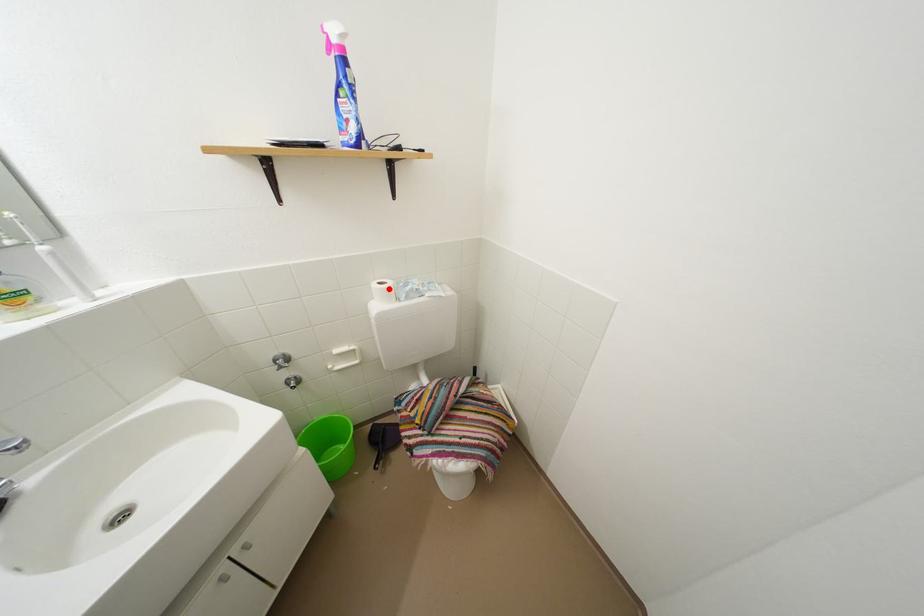
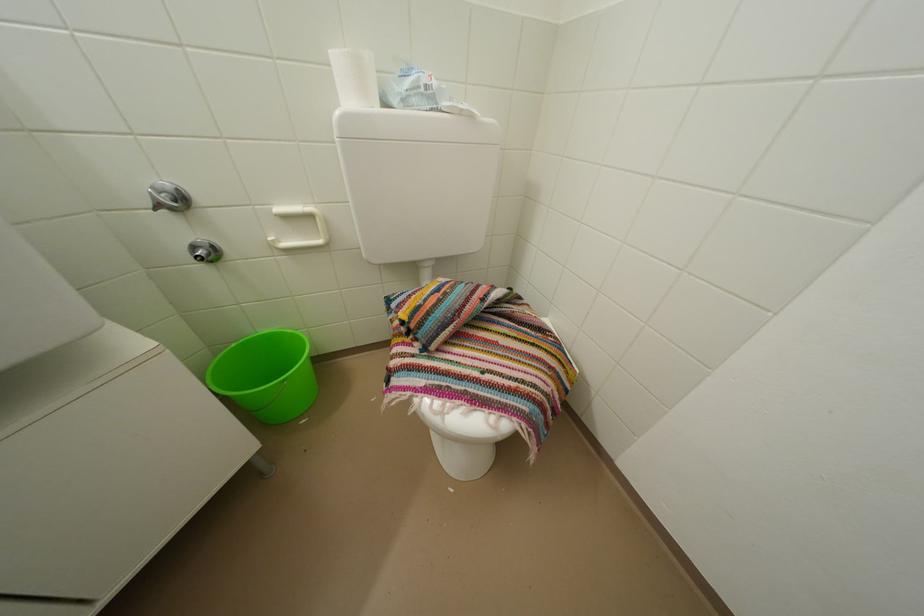
Locate, in the second image, the point that corresponds to the highlighted location in the first image.

(359, 55)